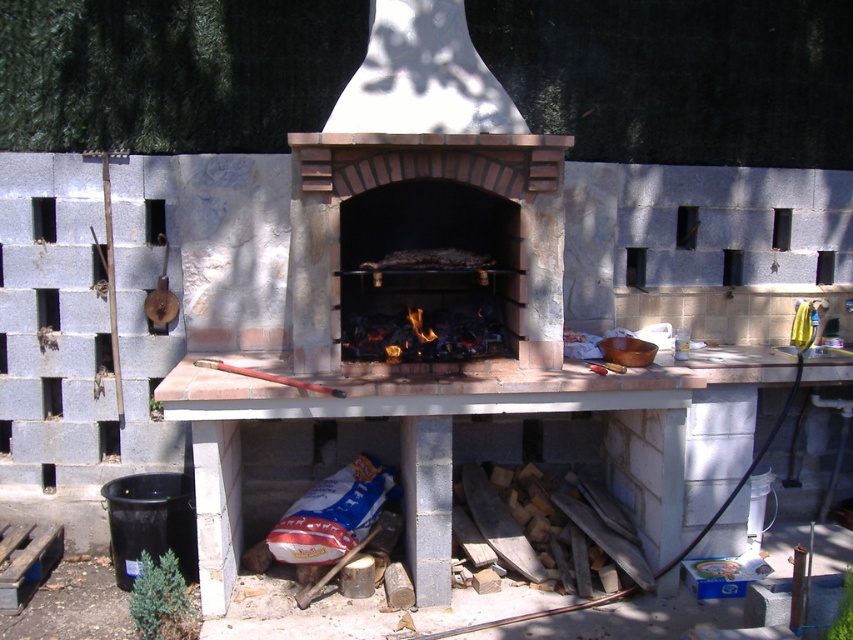
You are standing at the point marked by the coordinate point at point (426,250). What object is located exactly at that point?

The brick oven at center is located exactly at point (426,250).

You are standing in front of the brick oven at center and want to reach the charcoal briquettes at center to add more fuel. Can you directly touch them without moving any objects in the scene?

The brick oven at center is closer to the viewer than the charcoal briquettes at center, so you cannot directly touch the charcoal briquettes at center without moving the brick oven at center.